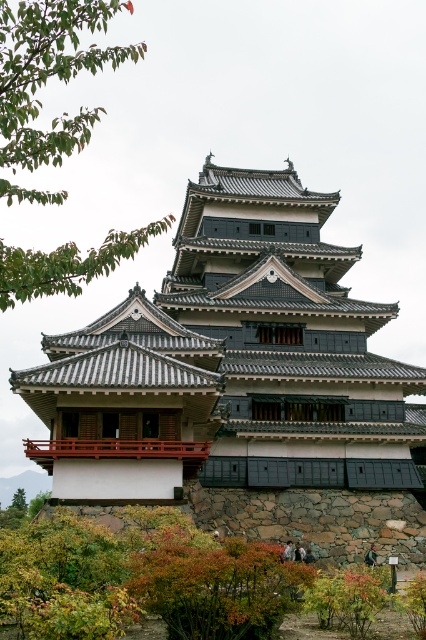
Question: Is green leafy branch at upper left to the left of green leafy tree at lower left from the viewer's perspective?

Choices:
 (A) yes
 (B) no

Answer: (B)

Question: Which of the following is the farthest from the observer?

Choices:
 (A) green leafy tree at lower left
 (B) green leafy branch at upper left

Answer: (A)

Question: Does stone gray temple at center have a larger size compared to green leafy branch at upper left?

Choices:
 (A) yes
 (B) no

Answer: (B)

Question: Which object is positioned closest to the green leafy tree at lower left?

Choices:
 (A) green leafy branch at upper left
 (B) stone gray temple at center

Answer: (A)

Question: Estimate the real-world distances between objects in this image. Which object is farther from the green leafy branch at upper left?

Choices:
 (A) stone gray temple at center
 (B) green leafy tree at lower left

Answer: (B)

Question: Is stone gray temple at center bigger than green leafy tree at lower left?

Choices:
 (A) no
 (B) yes

Answer: (B)